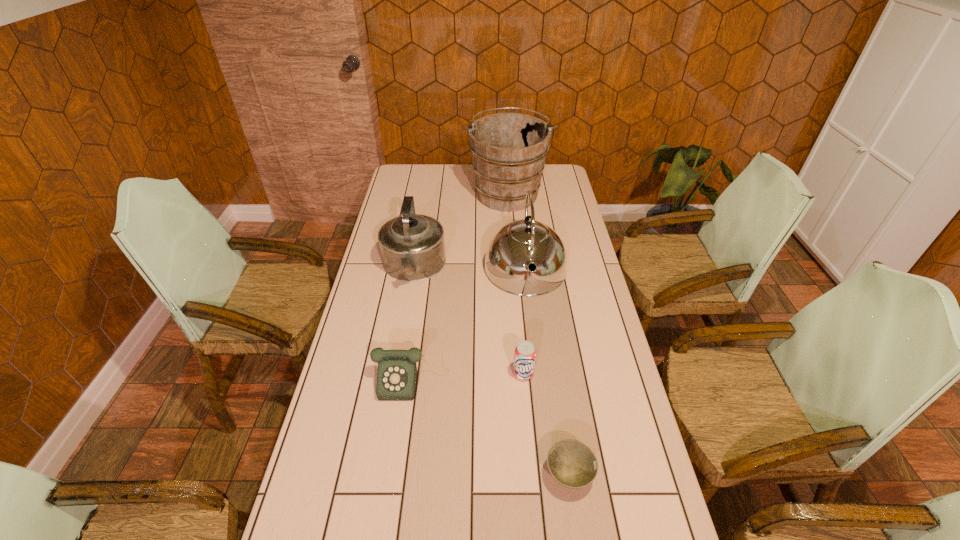
Where is `object that is at the far right corner`? This screenshot has width=960, height=540. object that is at the far right corner is located at coordinates (509, 150).

In the image, there is a desktop. Where is `free space at the left edge`? free space at the left edge is located at coordinates (388, 304).

This screenshot has width=960, height=540. In order to click on vacant space at the right edge of the desktop in this screenshot , I will do `click(579, 261)`.

In the image, there is a desktop. Where is `vacant space at the far left corner`? Image resolution: width=960 pixels, height=540 pixels. vacant space at the far left corner is located at coordinates (397, 183).

You are a GUI agent. You are given a task and a screenshot of the screen. Output one action in this format:
    pyautogui.click(x=<x>, y=<y>)
    Task: Click on the vacant area that lies between the shorter kettle and the soda can
    
    Given the screenshot: What is the action you would take?
    pyautogui.click(x=468, y=321)

Image resolution: width=960 pixels, height=540 pixels. Find the location of `free spot between the soda can and the bowl`. free spot between the soda can and the bowl is located at coordinates [546, 424].

I want to click on free space between the telephone and the right kettle, so click(468, 325).

I want to click on free point between the right kettle and the left kettle, so click(x=469, y=269).

Find the location of a particular element. object that is the closest to the bucket is located at coordinates tap(513, 247).

Identify which object is the second nearest to the left kettle. Please provide its 2D coordinates. Your answer should be formatted as a tuple, i.e. [(x, y)], where the tuple contains the x and y coordinates of a point satisfying the conditions above.

[(509, 150)]